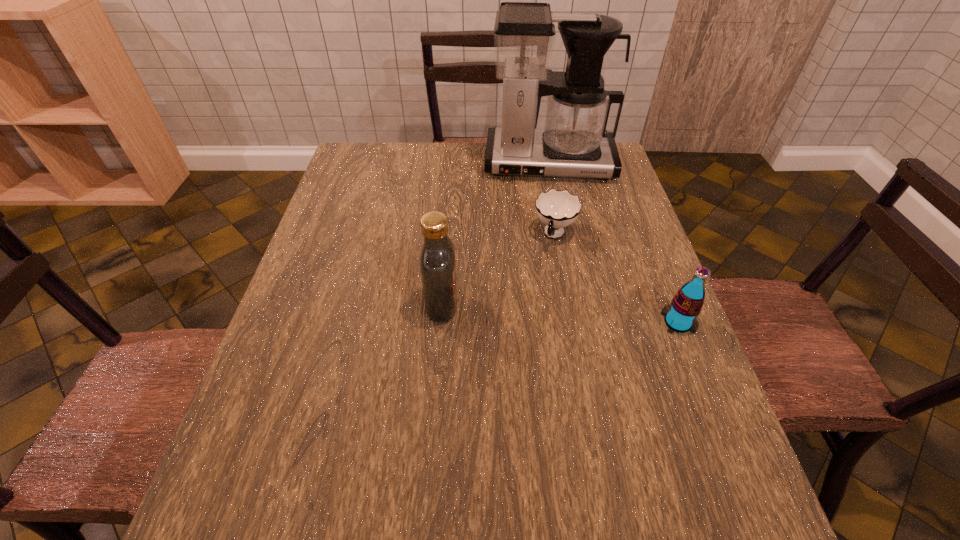
This screenshot has width=960, height=540. In the image, there is a desktop. What are the coordinates of `vacant space at the near edge` in the screenshot? It's located at (441, 439).

Locate an element on the screen. The image size is (960, 540). blank area at the left edge is located at coordinates (334, 197).

Locate an element on the screen. This screenshot has width=960, height=540. vacant position at the right edge of the desktop is located at coordinates (617, 248).

Locate an element on the screen. vacant space at the far left corner is located at coordinates (346, 173).

The image size is (960, 540). Find the location of `blank space at the near left corner of the desktop`. blank space at the near left corner of the desktop is located at coordinates (277, 446).

You are a GUI agent. You are given a task and a screenshot of the screen. Output one action in this format:
    pyautogui.click(x=<x>, y=<y>)
    Task: Click on the vacant space at the near right corner of the desktop
    
    Given the screenshot: What is the action you would take?
    tap(690, 449)

Where is `free space between the soda and the third nearest object`? This screenshot has width=960, height=540. free space between the soda and the third nearest object is located at coordinates (616, 279).

In order to click on vacant space that's between the leftmost object and the coffee maker in this screenshot , I will do `click(495, 234)`.

Where is `empty space that is in between the vodka and the soda`? The image size is (960, 540). empty space that is in between the vodka and the soda is located at coordinates (560, 313).

I want to click on free space between the second tallest object and the second shortest object, so click(560, 313).